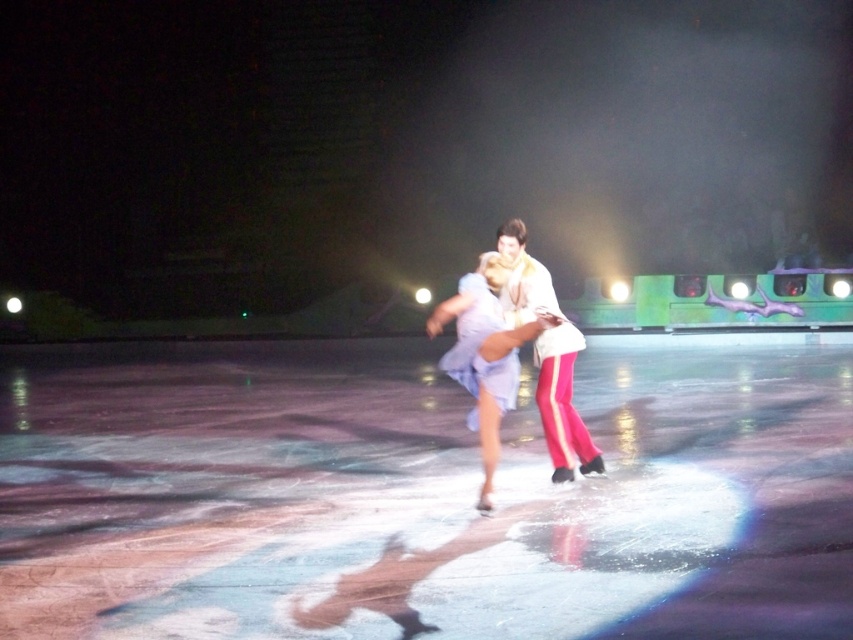
You are a photographer at the back of the stage, and you want to capture the light blue fabric dress at center and the glossy ice skating rink at center in your shot. Which object should you focus on first if you want to ensure both are in focus?

The glossy ice skating rink at center is located below the light blue fabric dress at center, so you should focus on the light blue fabric dress at center first since it is closer to the camera.

Based on the photo, you are an ice skater standing at the edge of the rink and want to move towards the two points marked in the scene. Which point, point (445, 589) or point (469, 328), is closer to you?

Point (445, 589) is closer to the viewer than point (469, 328), so you should move towards point (445, 589) first.